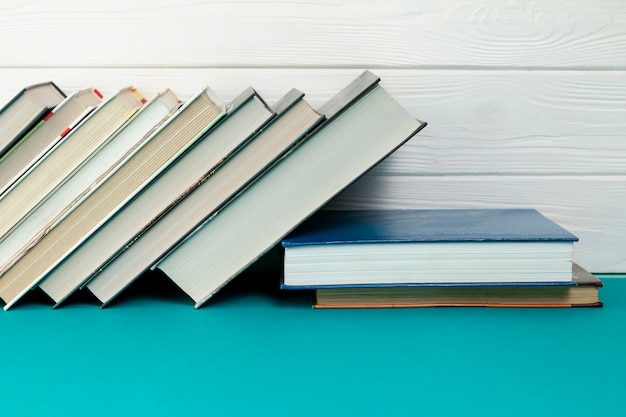
Identify the location of books. (24, 105), (63, 116), (98, 127), (136, 134), (161, 146), (201, 153), (265, 151), (300, 174), (362, 270), (387, 303).